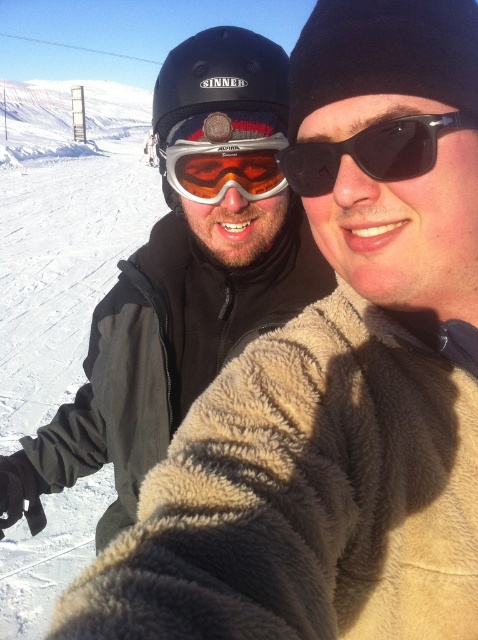
Question: Does matte black goggles at upper center have a greater width compared to matte orange ski goggles at center?

Choices:
 (A) yes
 (B) no

Answer: (B)

Question: Considering the real-world distances, which object is farthest from the matte orange ski goggles at center?

Choices:
 (A) matte black helmet at upper left
 (B) matte black goggles at upper center

Answer: (B)

Question: Is matte black helmet at upper left thinner than matte orange ski goggles at center?

Choices:
 (A) yes
 (B) no

Answer: (B)

Question: In this image, where is matte black helmet at upper left located relative to matte orange ski goggles at center?

Choices:
 (A) above
 (B) below

Answer: (B)

Question: Which object is the closest to the matte orange ski goggles at center?

Choices:
 (A) matte black goggles at upper center
 (B) matte black helmet at upper left

Answer: (B)

Question: Which object appears closest to the camera in this image?

Choices:
 (A) matte black goggles at upper center
 (B) matte black helmet at upper left

Answer: (A)